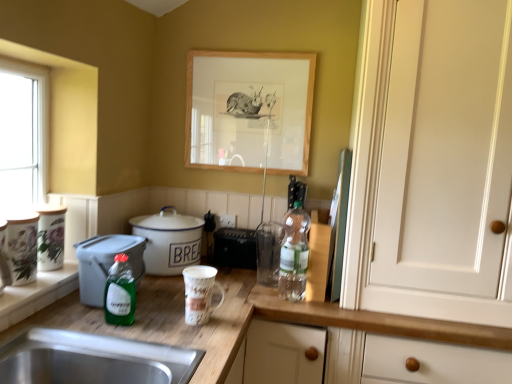
Measure the distance between point (x=159, y=219) and camera.

Point (x=159, y=219) is 1.68 meters from camera.

This screenshot has height=384, width=512. I want to click on green glass bottle at center, which is the 2th bottle in back-to-front order, so click(120, 293).

Describe the element at coordinates (243, 246) in the screenshot. I see `black plastic toaster at center, which is counted as the 3th appliance, starting from the left` at that location.

This screenshot has height=384, width=512. What do you see at coordinates (106, 263) in the screenshot?
I see `green plastic container at left, acting as the 1th cooker starting from the front` at bounding box center [106, 263].

This screenshot has width=512, height=384. What do you see at coordinates (338, 227) in the screenshot?
I see `green matte refrigerator at center-right, the fourth appliance from the left` at bounding box center [338, 227].

This screenshot has height=384, width=512. What do you see at coordinates (200, 293) in the screenshot? I see `matte ceramic mug at center, the second appliance from the left` at bounding box center [200, 293].

The image size is (512, 384). Describe the element at coordinates (50, 237) in the screenshot. I see `porcelain floral canister at left, the 2th appliance from the front` at that location.

Where is `white enamel cooker at center, the 2th cooker viewed from the front`? white enamel cooker at center, the 2th cooker viewed from the front is located at coordinates (169, 241).

Considering the points (88, 272) and (46, 225), which point is in front, point (88, 272) or point (46, 225)?

The point (88, 272) is in front.

Considering the positions of objects green plastic container at left, acting as the 1th cooker starting from the front, and porcelain floral canister at left, which is the third appliance in back-to-front order, in the image provided, who is more to the right, green plastic container at left, acting as the 1th cooker starting from the front, or porcelain floral canister at left, which is the third appliance in back-to-front order,?

green plastic container at left, acting as the 1th cooker starting from the front.

In terms of size, does green plastic container at left, acting as the 1th cooker starting from the front, appear bigger or smaller than porcelain floral canister at left, the 2th appliance from the front?

green plastic container at left, acting as the 1th cooker starting from the front, is bigger than porcelain floral canister at left, the 2th appliance from the front.

Are green plastic container at left, acting as the 1th cooker starting from the front, and porcelain floral canister at left, the fourth appliance positioned from the right, beside each other?

No, green plastic container at left, acting as the 1th cooker starting from the front, is not next to porcelain floral canister at left, the fourth appliance positioned from the right.

Can you tell me how much white enamel cooker at center, the 2th cooker viewed from the front, and translucent plastic bottle at center, the first bottle from the right, differ in facing direction?

white enamel cooker at center, the 2th cooker viewed from the front, and translucent plastic bottle at center, the first bottle from the right, are facing 88.7 degrees away from each other.

You are a GUI agent. You are given a task and a screenshot of the screen. Output one action in this format:
    pyautogui.click(x=<x>, y=<y>)
    Task: Click on the bottle located on the right of white enamel cooker at center, positioned as the first cooker in back-to-front order
    The image size is (512, 384).
    Given the screenshot: What is the action you would take?
    pyautogui.click(x=294, y=254)

Is white enamel cooker at center, the 2th cooker viewed from the front, placed right next to translucent plastic bottle at center, the 2th bottle when ordered from front to back?

There is a gap between white enamel cooker at center, the 2th cooker viewed from the front, and translucent plastic bottle at center, the 2th bottle when ordered from front to back.

Would you say white enamel cooker at center, the 2th cooker viewed from the front, contains translucent plastic bottle at center, the first bottle from the right?

No, translucent plastic bottle at center, the first bottle from the right, is located outside of white enamel cooker at center, the 2th cooker viewed from the front.

What's the angular difference between white enamel cooker at center, positioned as the first cooker in back-to-front order, and black plastic toaster at center, marked as the first appliance in a back-to-front arrangement,'s facing directions?

The angle between the facing direction of white enamel cooker at center, positioned as the first cooker in back-to-front order, and the facing direction of black plastic toaster at center, marked as the first appliance in a back-to-front arrangement, is 90 degrees.

Consider the image. Is the position of white enamel cooker at center, the 2th cooker viewed from the front, less distant than that of black plastic toaster at center, marked as the first appliance in a back-to-front arrangement?

Yes.

From the image's perspective, would you say white enamel cooker at center, positioned as the first cooker in back-to-front order, is positioned over black plastic toaster at center, which is counted as the 3th appliance, starting from the left?

Correct, white enamel cooker at center, positioned as the first cooker in back-to-front order, appears higher than black plastic toaster at center, which is counted as the 3th appliance, starting from the left, in the image.

Is the surface of white enamel cooker at center, the 2th cooker viewed from the front, in direct contact with black plastic toaster at center, which is the fourth appliance from front to back?

white enamel cooker at center, the 2th cooker viewed from the front, and black plastic toaster at center, which is the fourth appliance from front to back, are clearly separated.

Which of these two, wooden picture frame at upper center or matte ceramic mug at center, the second appliance from the left, stands taller?

wooden picture frame at upper center is taller.

Is wooden picture frame at upper center in contact with matte ceramic mug at center, the fourth appliance viewed from the back?

No, wooden picture frame at upper center is not touching matte ceramic mug at center, the fourth appliance viewed from the back.

Which is more to the right, wooden picture frame at upper center or matte ceramic mug at center, the fourth appliance viewed from the back?

Positioned to the right is wooden picture frame at upper center.

Which of these two, wooden picture frame at upper center or matte ceramic mug at center, the second appliance from the left, is smaller?

Smaller between the two is matte ceramic mug at center, the second appliance from the left.

Which is closer, (183, 264) or (85, 302)?

Point (85, 302)

Is the surface of white enamel cooker at center, the 2th cooker viewed from the front, in direct contact with green plastic container at left, arranged as the second cooker when viewed from the back?

No, white enamel cooker at center, the 2th cooker viewed from the front, is not next to green plastic container at left, arranged as the second cooker when viewed from the back.

Is white enamel cooker at center, the 2th cooker viewed from the front, surrounding green plastic container at left, arranged as the second cooker when viewed from the back?

No, green plastic container at left, arranged as the second cooker when viewed from the back, is located outside of white enamel cooker at center, the 2th cooker viewed from the front.

From the image's perspective, who appears lower, white enamel cooker at center, the 2th cooker viewed from the front, or green plastic container at left, arranged as the second cooker when viewed from the back?

green plastic container at left, arranged as the second cooker when viewed from the back, from the image's perspective.

Between green plastic container at left, acting as the 1th cooker starting from the front, and wooden picture frame at upper center, which one has larger width?

green plastic container at left, acting as the 1th cooker starting from the front, is wider.

From a real-world perspective, is green plastic container at left, acting as the 1th cooker starting from the front, below wooden picture frame at upper center?

Yes.

Choose the correct answer: Is green plastic container at left, acting as the 1th cooker starting from the front, inside wooden picture frame at upper center or outside it?

green plastic container at left, acting as the 1th cooker starting from the front, is outside wooden picture frame at upper center.

Who is smaller, green plastic container at left, arranged as the second cooker when viewed from the back, or wooden picture frame at upper center?

Smaller between the two is green plastic container at left, arranged as the second cooker when viewed from the back.

Is white enamel cooker at center, positioned as the first cooker in back-to-front order, not near matte ceramic mug at center, the second appliance from the left?

No, white enamel cooker at center, positioned as the first cooker in back-to-front order, is in close proximity to matte ceramic mug at center, the second appliance from the left.

Between white enamel cooker at center, the 2th cooker viewed from the front, and matte ceramic mug at center, the fourth appliance viewed from the back, which one appears on the left side from the viewer's perspective?

white enamel cooker at center, the 2th cooker viewed from the front, is more to the left.

Is white enamel cooker at center, positioned as the first cooker in back-to-front order, positioned beyond the bounds of matte ceramic mug at center, which is the third appliance in right-to-left order?

white enamel cooker at center, positioned as the first cooker in back-to-front order, lies outside matte ceramic mug at center, which is the third appliance in right-to-left order,'s area.

From the image's perspective, count 2nd appliances upward from the green plastic container at left, acting as the 1th cooker starting from the front, and point to it. Please provide its 2D coordinates.

[(50, 237)]

This screenshot has height=384, width=512. Identify the location of bottle on the right side of white enamel cooker at center, the 2th cooker viewed from the front. (294, 254).

Which object lies further to the anchor point green matte refrigerator at center-right, positioned as the second appliance in back-to-front order, white enamel cooker at center, the 2th cooker viewed from the front, or green glass bottle at center, which is the 2th bottle in back-to-front order?

Among the two, green glass bottle at center, which is the 2th bottle in back-to-front order, is located further to green matte refrigerator at center-right, positioned as the second appliance in back-to-front order.

Looking at the image, which one is located further to black plastic toaster at center, which is the fourth appliance from front to back, green glass bottle at center, which ranks as the 1th bottle in left-to-right order, or translucent plastic bottle at center, placed as the first bottle when sorted from back to front?

Based on the image, green glass bottle at center, which ranks as the 1th bottle in left-to-right order, appears to be further to black plastic toaster at center, which is the fourth appliance from front to back.

From the image, which object appears to be farther from green matte refrigerator at center-right, placed as the first appliance when sorted from right to left, white enamel cooker at center, positioned as the first cooker in back-to-front order, or translucent plastic bottle at center, the second bottle when ordered from left to right?

The object further to green matte refrigerator at center-right, placed as the first appliance when sorted from right to left, is white enamel cooker at center, positioned as the first cooker in back-to-front order.

When comparing their distances from white enamel cooker at center, the 2th cooker viewed from the front, does matte ceramic mug at center, positioned as the first appliance in front-to-back order, or green glass bottle at center, the second bottle from the right, seem further?

The object further to white enamel cooker at center, the 2th cooker viewed from the front, is green glass bottle at center, the second bottle from the right.

Considering their positions, is black plastic toaster at center, which is the fourth appliance from front to back, positioned closer to green plastic container at left, arranged as the second cooker when viewed from the back, than green matte refrigerator at center-right, which is the 3th appliance from front to back?

black plastic toaster at center, which is the fourth appliance from front to back, is positioned closer to the anchor green plastic container at left, arranged as the second cooker when viewed from the back.

Estimate the real-world distances between objects in this image. Which object is closer to white enamel cooker at center, the 2th cooker viewed from the front, porcelain floral canister at left, which ranks as the 1th appliance in left-to-right order, or green matte refrigerator at center-right, the fourth appliance from the left?

porcelain floral canister at left, which ranks as the 1th appliance in left-to-right order, lies closer to white enamel cooker at center, the 2th cooker viewed from the front, than the other object.

Estimate the real-world distances between objects in this image. Which object is further from translucent plastic bottle at center, placed as the first bottle when sorted from back to front, wooden picture frame at upper center or white enamel cooker at center, the 2th cooker viewed from the front?

wooden picture frame at upper center is further to translucent plastic bottle at center, placed as the first bottle when sorted from back to front.

Looking at this image, considering their positions, is porcelain floral canister at left, which is the third appliance in back-to-front order, positioned closer to matte ceramic mug at center, the fourth appliance viewed from the back, than green matte refrigerator at center-right, placed as the first appliance when sorted from right to left?

green matte refrigerator at center-right, placed as the first appliance when sorted from right to left.

The width and height of the screenshot is (512, 384). I want to click on bottle located between green glass bottle at center, the first bottle in the front-to-back sequence, and black plastic toaster at center, which is the 2th appliance in right-to-left order, in the depth direction, so click(294, 254).

The image size is (512, 384). In order to click on cooker positioned between green glass bottle at center, the first bottle in the front-to-back sequence, and white enamel cooker at center, the 2th cooker viewed from the front, from near to far in this screenshot , I will do `click(106, 263)`.

At what (x,y) coordinates should I click in order to perform the action: click on cooker situated between porcelain floral canister at left, the 2th appliance from the front, and green glass bottle at center, which ranks as the 1th bottle in left-to-right order, from left to right. Please return your answer as a coordinate pair (x, y). This screenshot has height=384, width=512. Looking at the image, I should click on coord(106,263).

This screenshot has width=512, height=384. What are the coordinates of `cooker between green plastic container at left, acting as the 1th cooker starting from the front, and green matte refrigerator at center-right, positioned as the second appliance in back-to-front order` in the screenshot? It's located at (169, 241).